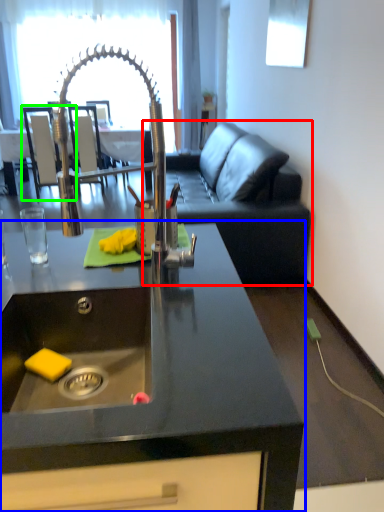
Question: Which object is the closest to the studio couch (highlighted by a red box)? Choose among these: countertop (highlighted by a blue box) or armchair (highlighted by a green box).

Choices:
 (A) countertop
 (B) armchair

Answer: (B)